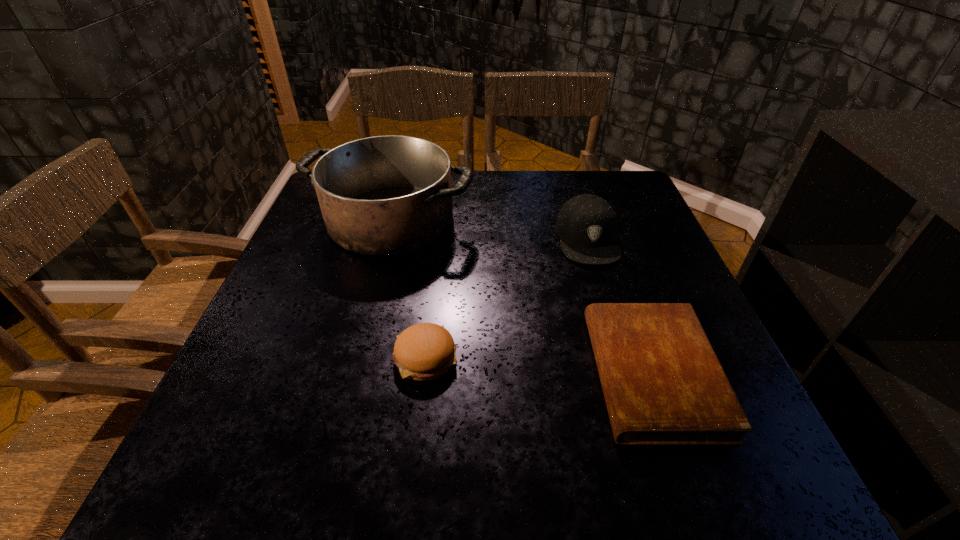
Image resolution: width=960 pixels, height=540 pixels. Find the location of `saucepan that is at the far edge`. saucepan that is at the far edge is located at coordinates (389, 195).

In order to click on cap at the far edge in this screenshot , I will do `click(586, 224)`.

Identify the location of object positioned at the near edge. (663, 384).

Locate an element on the screen. The image size is (960, 540). object situated at the left edge is located at coordinates (389, 195).

I want to click on cap that is at the right edge, so click(x=586, y=224).

The height and width of the screenshot is (540, 960). I want to click on Bible positioned at the right edge, so click(x=663, y=384).

Locate an element on the screen. The image size is (960, 540). object that is at the far left corner is located at coordinates (389, 195).

The width and height of the screenshot is (960, 540). I want to click on object present at the far right corner, so click(x=586, y=224).

The height and width of the screenshot is (540, 960). What are the coordinates of `object present at the near right corner` in the screenshot? It's located at (663, 384).

In the image, there is a desktop. Identify the location of vacant space at the far edge. The image size is (960, 540). (504, 199).